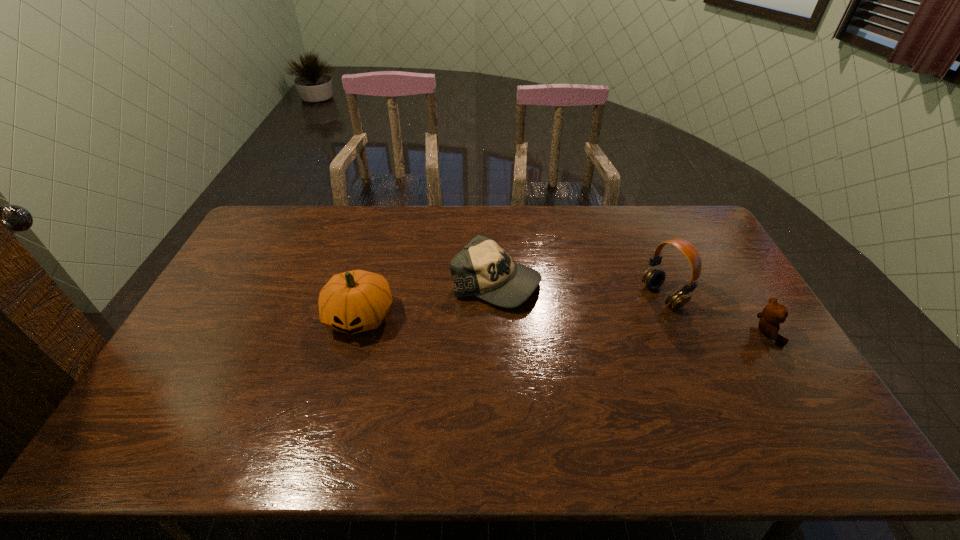
Locate an element on the screen. The width and height of the screenshot is (960, 540). gourd is located at coordinates (355, 301).

Where is `the third shortest object`? The height and width of the screenshot is (540, 960). the third shortest object is located at coordinates (355, 301).

The height and width of the screenshot is (540, 960). In order to click on teddy bear in this screenshot , I will do `click(774, 313)`.

At what (x,y) coordinates should I click in order to perform the action: click on headset. Please return your answer as a coordinate pair (x, y). The image size is (960, 540). Looking at the image, I should click on (653, 278).

This screenshot has width=960, height=540. I want to click on baseball cap, so click(x=482, y=268).

Identify the location of vacant space located 0.160m on the side of the second tallest object with the carved face. This screenshot has width=960, height=540. (339, 394).

This screenshot has width=960, height=540. I want to click on free space located 0.280m on the ear cups of the headset, so click(573, 336).

The height and width of the screenshot is (540, 960). I want to click on blank space located 0.340m on the ear cups of the headset, so click(x=556, y=344).

Find the location of a particular element. The image size is (960, 540). vacant area situated 0.390m on the ear cups of the headset is located at coordinates (541, 350).

Locate an element on the screen. vacant space situated on the front-facing side of the baseball cap is located at coordinates (614, 343).